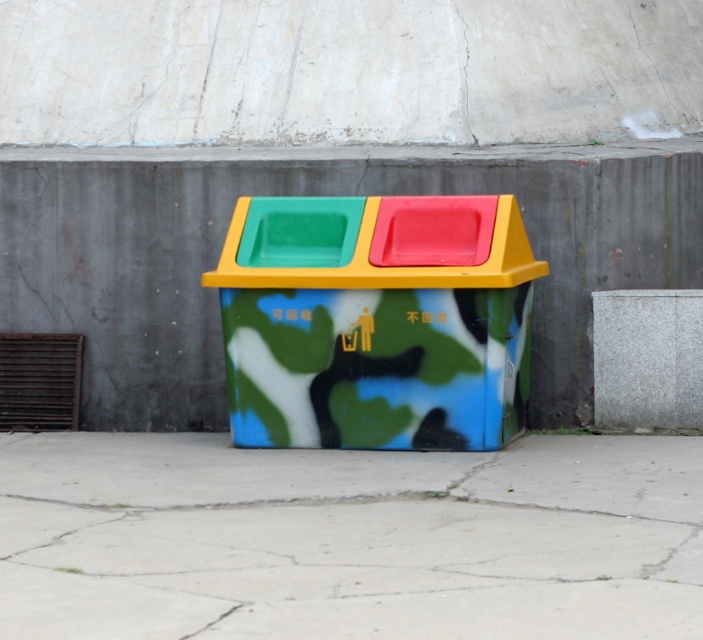
Question: Is concrete at center below gray concrete wall at center?

Choices:
 (A) yes
 (B) no

Answer: (A)

Question: Which point is farther from the camera taking this photo?

Choices:
 (A) (451, 288)
 (B) (692, 509)

Answer: (A)

Question: Which point is closer to the camera?

Choices:
 (A) (612, 317)
 (B) (389, 344)
 (C) (607, 520)

Answer: (C)

Question: Can you confirm if camouflage paint recycling bin at center is positioned above gray concrete wall at center?

Choices:
 (A) yes
 (B) no

Answer: (A)

Question: Does camouflage paint recycling bin at center come in front of gray concrete wall at center?

Choices:
 (A) yes
 (B) no

Answer: (A)

Question: Among these points, which one is nearest to the camera?

Choices:
 (A) [x=451, y=241]
 (B) [x=297, y=451]

Answer: (A)